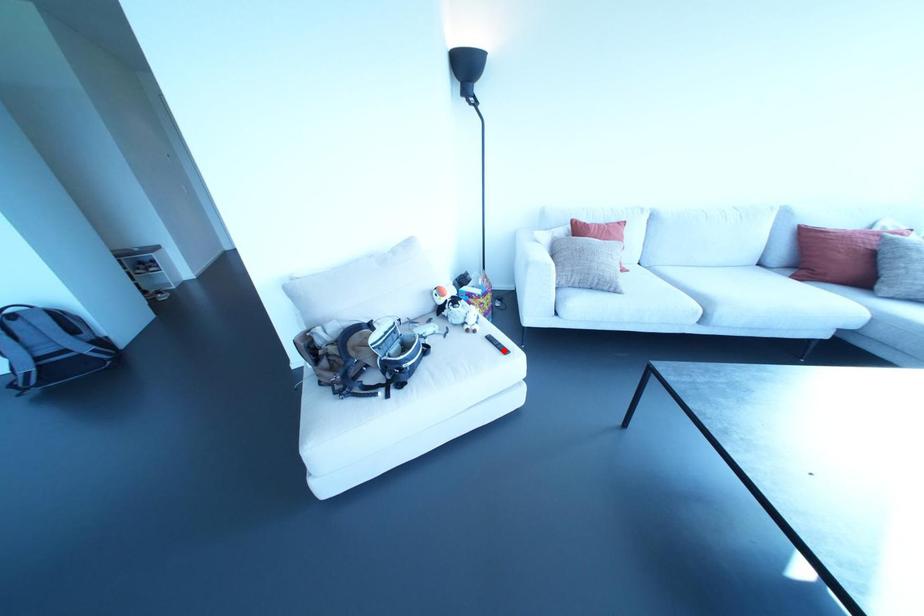
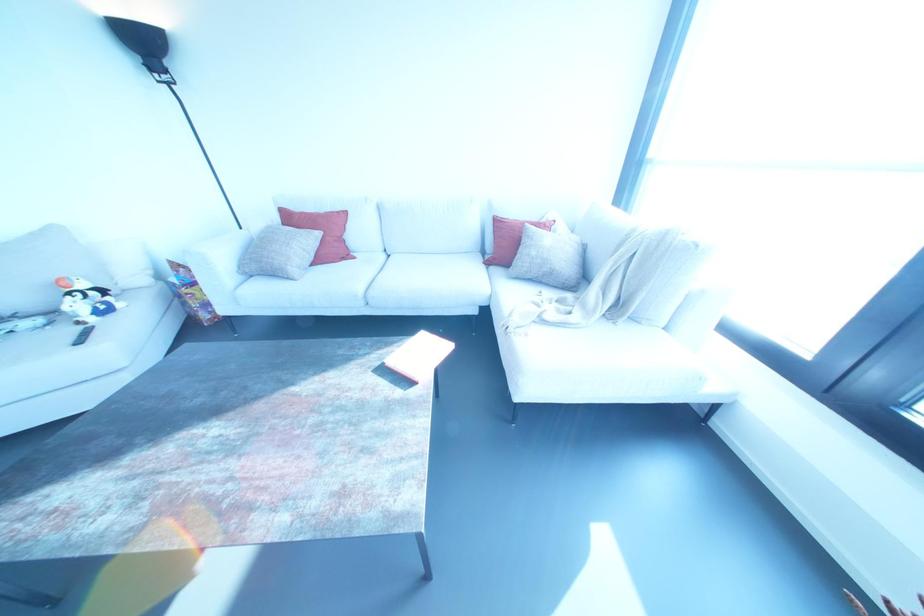
Where in the second image is the point corresponding to the highlighted location from the first image?

(78, 341)